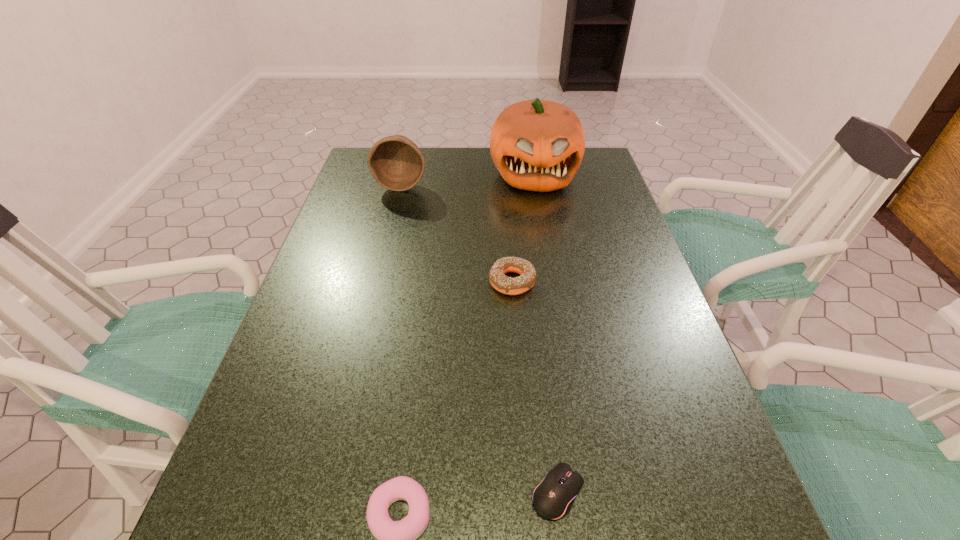
This screenshot has height=540, width=960. I want to click on vacant area that lies between the second tallest object and the computer mouse, so click(480, 339).

Identify which object is located as the third nearest to the third farthest object. Please provide its 2D coordinates. Your answer should be formatted as a tuple, i.e. [(x, y)], where the tuple contains the x and y coordinates of a point satisfying the conditions above.

[(396, 162)]

Locate which object is the third closest to the computer mouse. Please provide its 2D coordinates. Your answer should be formatted as a tuple, i.e. [(x, y)], where the tuple contains the x and y coordinates of a point satisfying the conditions above.

[(538, 145)]

Identify the location of free location that satisfies the following two spatial constraints: 1. on the front side of the third nearest object; 2. on the left side of the bowl. (377, 282).

I want to click on free location that satisfies the following two spatial constraints: 1. on the front side of the third farthest object; 2. on the left side of the computer mouse, so click(x=528, y=492).